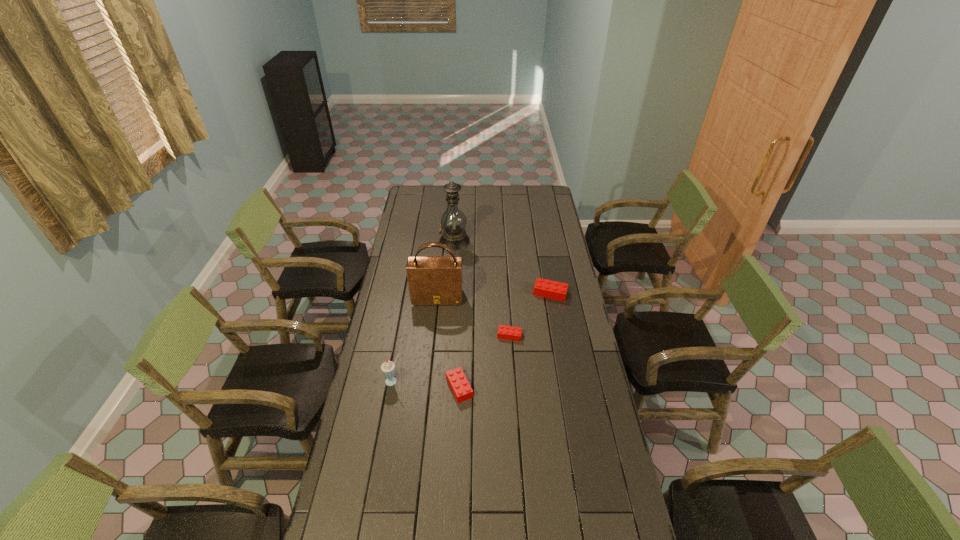
You are a GUI agent. You are given a task and a screenshot of the screen. Output one action in this format:
    pyautogui.click(x=<x>, y=<y>)
    Task: Click on the free space for a new Lego on the left
    The width and height of the screenshot is (960, 540).
    Given the screenshot: What is the action you would take?
    pyautogui.click(x=396, y=454)